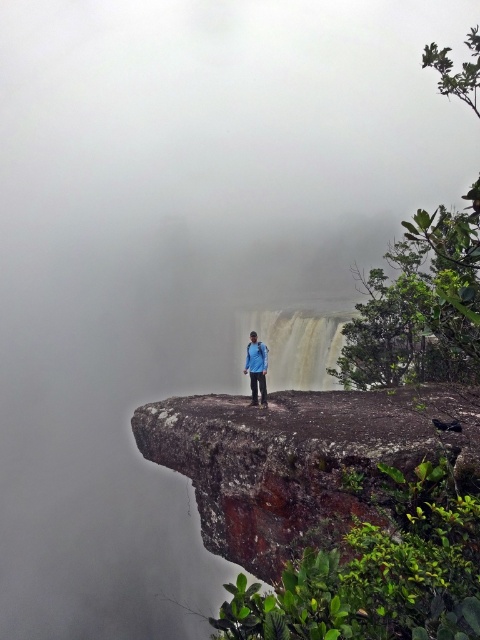
You are a hiker who wants to cross from the rusty rock cliff at center to the smooth white waterfall at center. The distance between them is 84.43 feet. If your maximum jumping distance is 10 feet, how many jumps will you need to make?

The distance between the rusty rock cliff at center and the smooth white waterfall at center is 84.43 feet. Since your maximum jump is 10 feet, you would need at least 9 jumps to cover the distance.

You are a hiker who wants to take a photo of the smooth white waterfall at center and the blue fabric jacket at center. Which object should you focus on first if you want to capture both in the same frame without moving the camera?

The smooth white waterfall at center is much taller than the blue fabric jacket at center, so you should focus on the smooth white waterfall at center first to ensure it fits entirely in the frame before adjusting for the blue fabric jacket at center.

You are a hiker who wants to take a photo of the rusty rock cliff at center from a safe distance. Based on the coordinates provided in the Objects Description, can you determine if the cliff is positioned centrally in the image?

The rusty rock cliff at center is located at point (300, 460), which indicates its position is slightly offset from the exact center of the image. However, since the object label mentions it is at the center, it can be considered centrally positioned for practical purposes.